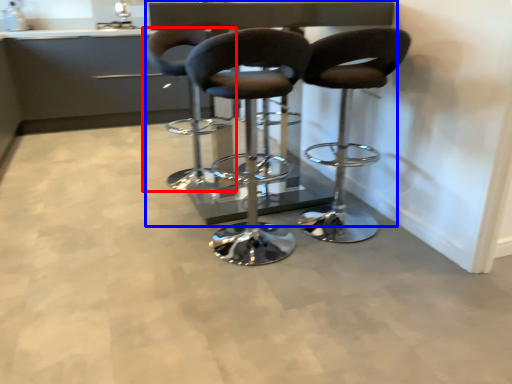
Question: Among these objects, which one is nearest to the camera, chair (highlighted by a red box) or table (highlighted by a blue box)?

Choices:
 (A) chair
 (B) table

Answer: (B)